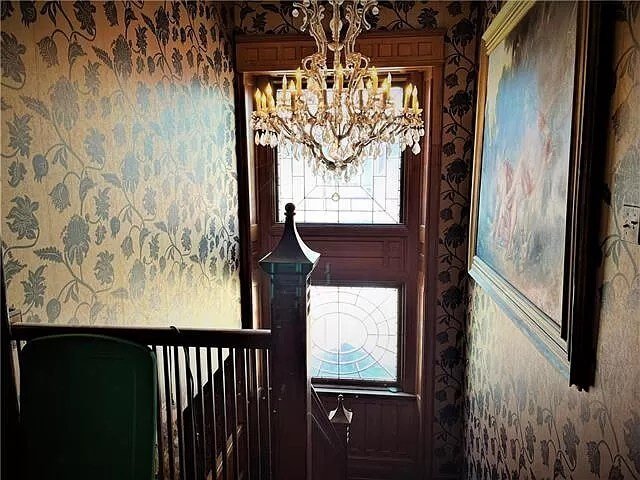
At what (x,y) coordinates should I click in order to perform the action: click on newel post. Please return your answer as a coordinate pair (x, y). Looking at the image, I should click on (344, 439), (288, 326).